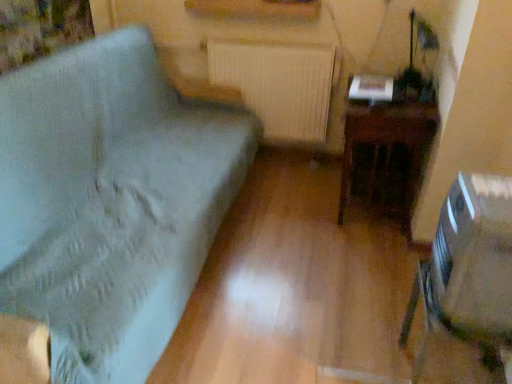
Question: Considering the relative sizes of clear plastic swivel chair at lower right and light blue fabric cushion at left in the image provided, is clear plastic swivel chair at lower right taller than light blue fabric cushion at left?

Choices:
 (A) no
 (B) yes

Answer: (A)

Question: Does clear plastic swivel chair at lower right have a lesser height compared to light blue fabric cushion at left?

Choices:
 (A) no
 (B) yes

Answer: (B)

Question: Does clear plastic swivel chair at lower right have a greater width compared to light blue fabric cushion at left?

Choices:
 (A) no
 (B) yes

Answer: (A)

Question: Is clear plastic swivel chair at lower right closer to camera compared to light blue fabric cushion at left?

Choices:
 (A) no
 (B) yes

Answer: (A)

Question: Does clear plastic swivel chair at lower right have a larger size compared to light blue fabric cushion at left?

Choices:
 (A) yes
 (B) no

Answer: (B)

Question: Would you say light blue fabric cushion at left is part of clear plastic swivel chair at lower right's contents?

Choices:
 (A) yes
 (B) no

Answer: (B)

Question: Does clear plastic swivel chair at lower right have a lesser width compared to white textured radiator at center?

Choices:
 (A) no
 (B) yes

Answer: (A)

Question: From a real-world perspective, is clear plastic swivel chair at lower right physically above white textured radiator at center?

Choices:
 (A) yes
 (B) no

Answer: (A)

Question: Is clear plastic swivel chair at lower right oriented towards white textured radiator at center?

Choices:
 (A) yes
 (B) no

Answer: (B)

Question: Can you confirm if clear plastic swivel chair at lower right is taller than white textured radiator at center?

Choices:
 (A) yes
 (B) no

Answer: (B)

Question: From the image's perspective, would you say clear plastic swivel chair at lower right is positioned over white textured radiator at center?

Choices:
 (A) yes
 (B) no

Answer: (B)

Question: Is clear plastic swivel chair at lower right oriented away from white textured radiator at center?

Choices:
 (A) no
 (B) yes

Answer: (A)

Question: Is clear plastic swivel chair at lower right in contact with dark wood table at right?

Choices:
 (A) no
 (B) yes

Answer: (A)